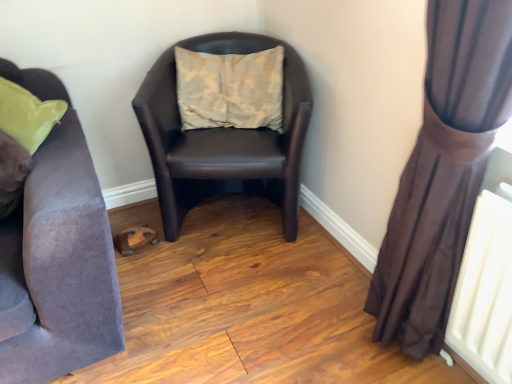
Question: Considering the relative positions of brown leather chair at center and beige fabric pillow at center in the image provided, is brown leather chair at center to the left of beige fabric pillow at center from the viewer's perspective?

Choices:
 (A) yes
 (B) no

Answer: (A)

Question: Is brown leather chair at center positioned with its back to beige fabric pillow at center?

Choices:
 (A) no
 (B) yes

Answer: (B)

Question: Is brown leather chair at center not within beige fabric pillow at center?

Choices:
 (A) yes
 (B) no

Answer: (A)

Question: Can you confirm if brown leather chair at center is thinner than beige fabric pillow at center?

Choices:
 (A) no
 (B) yes

Answer: (A)

Question: Is brown leather chair at center oriented towards beige fabric pillow at center?

Choices:
 (A) no
 (B) yes

Answer: (B)

Question: Is the position of brown leather chair at center more distant than that of beige fabric pillow at center?

Choices:
 (A) no
 (B) yes

Answer: (A)

Question: Can you confirm if brown leather chair at center is thinner than velvet purple couch at left?

Choices:
 (A) yes
 (B) no

Answer: (B)

Question: From the image's perspective, is brown leather chair at center beneath velvet purple couch at left?

Choices:
 (A) yes
 (B) no

Answer: (B)

Question: Does brown leather chair at center appear on the right side of velvet purple couch at left?

Choices:
 (A) yes
 (B) no

Answer: (A)

Question: Is brown leather chair at center taller than velvet purple couch at left?

Choices:
 (A) yes
 (B) no

Answer: (A)

Question: Is the surface of brown leather chair at center in direct contact with velvet purple couch at left?

Choices:
 (A) yes
 (B) no

Answer: (B)

Question: Can you confirm if brown leather chair at center is positioned to the left of velvet purple couch at left?

Choices:
 (A) no
 (B) yes

Answer: (A)

Question: Is brown sheer curtain at right taller than beige fabric pillow at center?

Choices:
 (A) yes
 (B) no

Answer: (A)